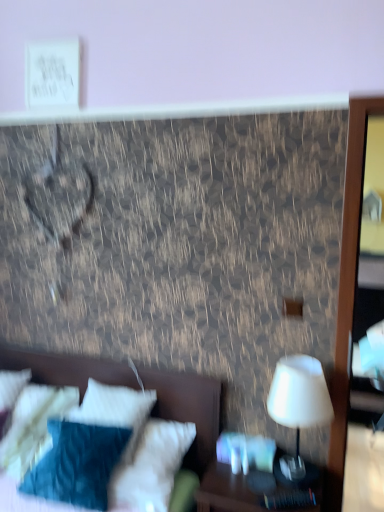
Question: Should I look upward or downward to see wooden nightstand at lower right?

Choices:
 (A) down
 (B) up

Answer: (A)

Question: Does wooden nightstand at lower right have a lesser width compared to white soft bed at lower left?

Choices:
 (A) no
 (B) yes

Answer: (B)

Question: Would you say wooden nightstand at lower right contains white soft bed at lower left?

Choices:
 (A) yes
 (B) no

Answer: (B)

Question: Is wooden nightstand at lower right shorter than white soft bed at lower left?

Choices:
 (A) yes
 (B) no

Answer: (A)

Question: Does wooden nightstand at lower right turn towards white soft bed at lower left?

Choices:
 (A) yes
 (B) no

Answer: (B)

Question: From a real-world perspective, is wooden nightstand at lower right positioned under white soft bed at lower left based on gravity?

Choices:
 (A) yes
 (B) no

Answer: (A)

Question: Is wooden nightstand at lower right facing away from white soft bed at lower left?

Choices:
 (A) yes
 (B) no

Answer: (B)

Question: Could you tell me if white soft pillow at lower left, which is the 1th pillow in right-to-left order, is facing white soft pillow at lower left, marked as the first pillow in a left-to-right arrangement?

Choices:
 (A) no
 (B) yes

Answer: (A)

Question: From the image's perspective, is white soft pillow at lower left, which is the second pillow in left-to-right order, on top of white soft pillow at lower left, marked as the first pillow in a left-to-right arrangement?

Choices:
 (A) no
 (B) yes

Answer: (B)

Question: Does white soft pillow at lower left, which is the 1th pillow in right-to-left order, have a smaller size compared to white soft pillow at lower left, marked as the first pillow in a left-to-right arrangement?

Choices:
 (A) no
 (B) yes

Answer: (B)

Question: Is white soft pillow at lower left, which is the 1th pillow in right-to-left order, wider than white soft pillow at lower left, marked as the first pillow in a left-to-right arrangement?

Choices:
 (A) yes
 (B) no

Answer: (B)

Question: Considering the relative sizes of white soft pillow at lower left, which is the second pillow in left-to-right order, and white soft pillow at lower left, marked as the first pillow in a left-to-right arrangement, in the image provided, is white soft pillow at lower left, which is the second pillow in left-to-right order, shorter than white soft pillow at lower left, marked as the first pillow in a left-to-right arrangement,?

Choices:
 (A) yes
 (B) no

Answer: (B)

Question: Can you confirm if white soft pillow at lower left, which is the second pillow in left-to-right order, is taller than white soft pillow at lower left, the 2th pillow positioned from the right?

Choices:
 (A) yes
 (B) no

Answer: (A)

Question: Is white soft pillow at lower left, which is the 1th pillow in right-to-left order, not inside wooden nightstand at lower right?

Choices:
 (A) no
 (B) yes

Answer: (B)